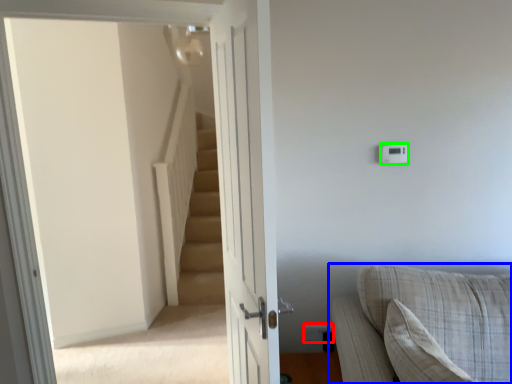
Question: Which object is positioned farthest from electric outlet (highlighted by a red box)? Select from studio couch (highlighted by a blue box) and light switch (highlighted by a green box).

Choices:
 (A) studio couch
 (B) light switch

Answer: (B)